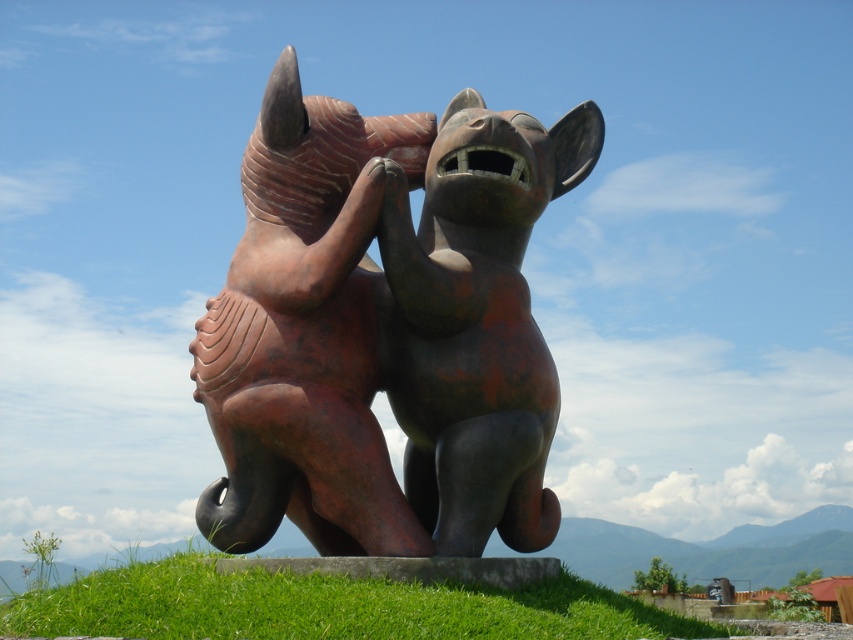
Question: Can you confirm if rusty bronze rhino at center is bigger than green grass at center?

Choices:
 (A) no
 (B) yes

Answer: (A)

Question: Does rusty bronze rhino at center have a lesser width compared to green grass at center?

Choices:
 (A) no
 (B) yes

Answer: (B)

Question: Does rusty bronze rhino at center have a lesser width compared to green grass at center?

Choices:
 (A) no
 (B) yes

Answer: (B)